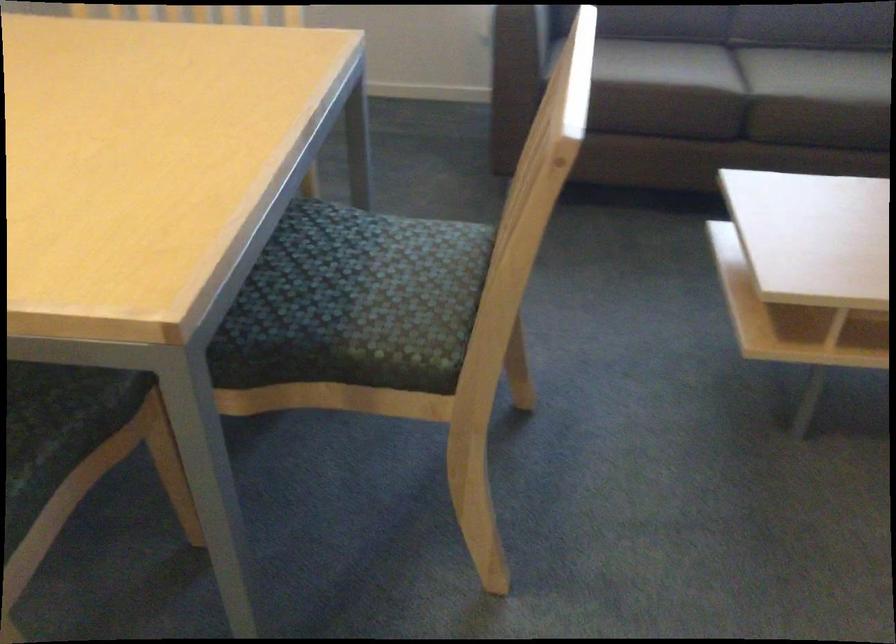
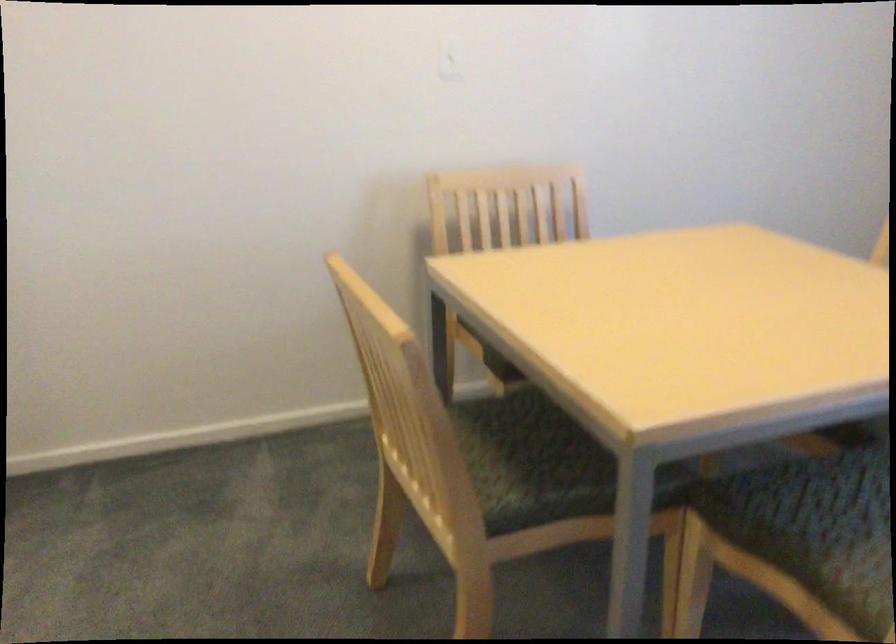
Question: The camera is either moving clockwise (left) or counter-clockwise (right) around the object. The first image is from the beginning of the video and the second image is from the end. Is the camera moving left or right when shooting the video?

Choices:
 (A) Left
 (B) Right

Answer: (B)